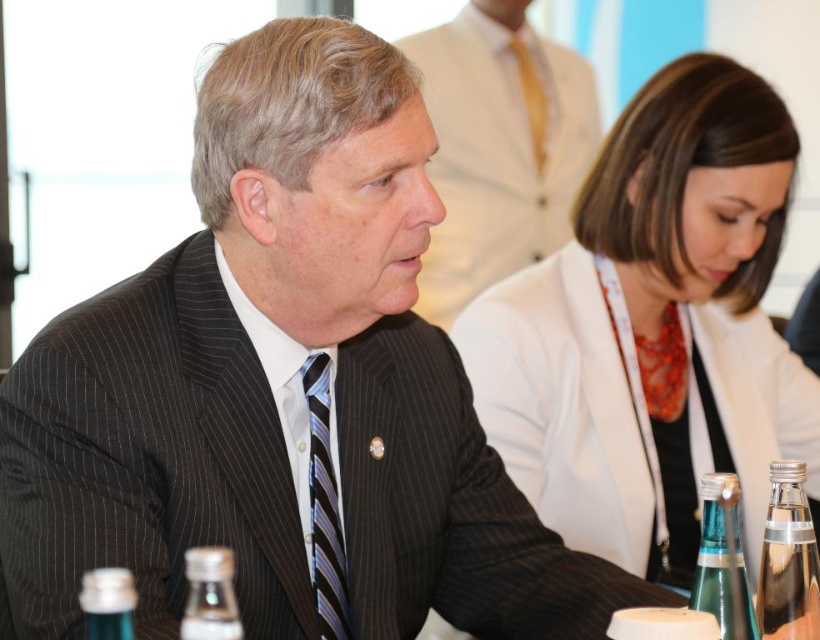
You are organizing a meeting and need to place a name tag on the table. The name tag is 10 cm in height. Which object, the clear glass bottle at lower center or the satin yellow tie at center, can the name tag be placed on top of without exceeding its height?

The name tag can be placed on the clear glass bottle at lower center because it is not as tall as the satin yellow tie at center, meaning the bottle has a lower height and the name tag will fit on top.